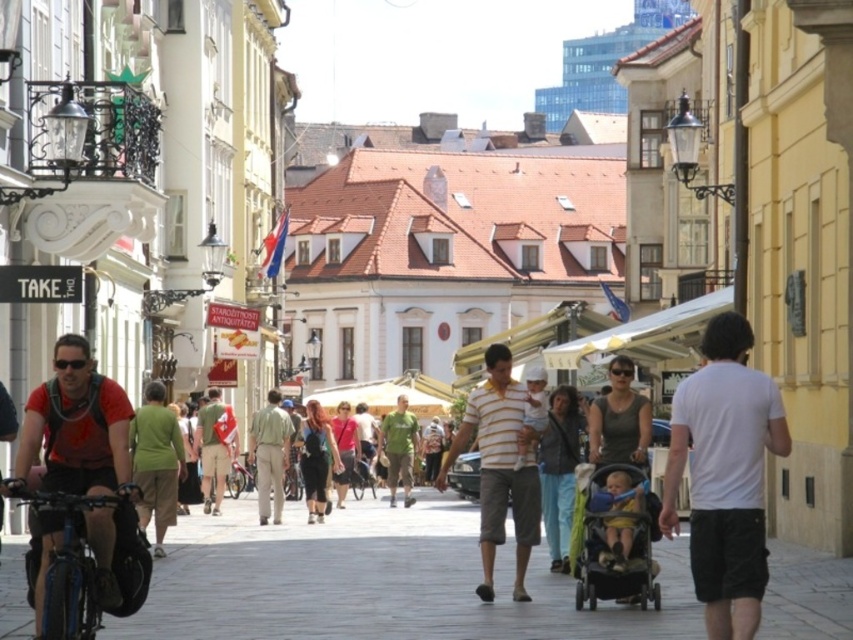
Between striped cotton shirt at center and green fabric shirt at center, which one is positioned higher?

striped cotton shirt at center is higher up.

What do you see at coordinates (502, 467) in the screenshot? Image resolution: width=853 pixels, height=640 pixels. I see `striped cotton shirt at center` at bounding box center [502, 467].

At what (x,y) coordinates should I click in order to perform the action: click on striped cotton shirt at center. Please return your answer as a coordinate pair (x, y). Looking at the image, I should click on (502, 467).

Which of these two, white cotton t-shirt at right or striped cotton shirt at center, stands shorter?

Standing shorter between the two is striped cotton shirt at center.

Find the location of `white cotton t-shirt at right`. white cotton t-shirt at right is located at coordinates (724, 476).

Between striped cotton shirt at center and black matte bicycle helmet at lower left, which one appears on the right side from the viewer's perspective?

From the viewer's perspective, striped cotton shirt at center appears more on the right side.

Does striped cotton shirt at center have a larger size compared to black matte bicycle helmet at lower left?

Yes.

The height and width of the screenshot is (640, 853). I want to click on striped cotton shirt at center, so click(502, 467).